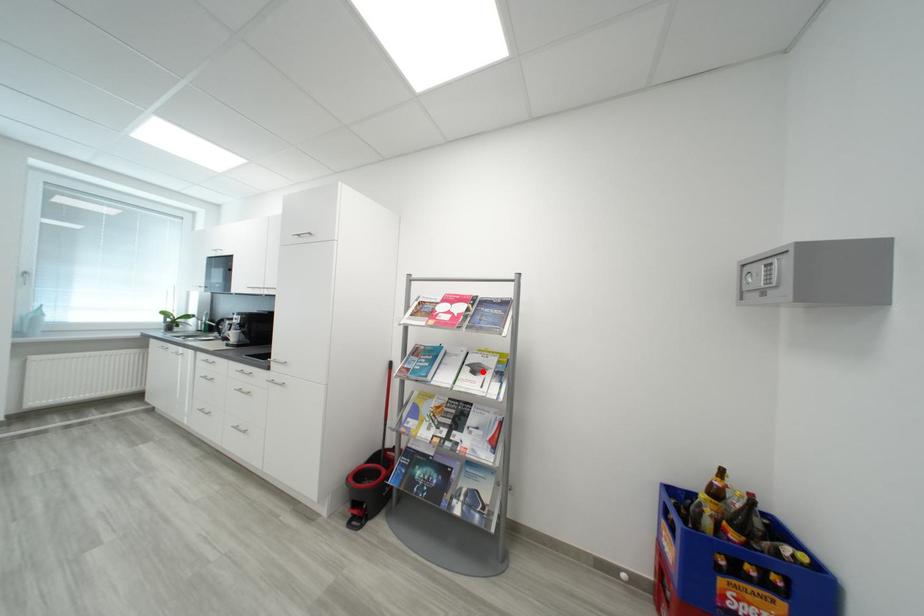
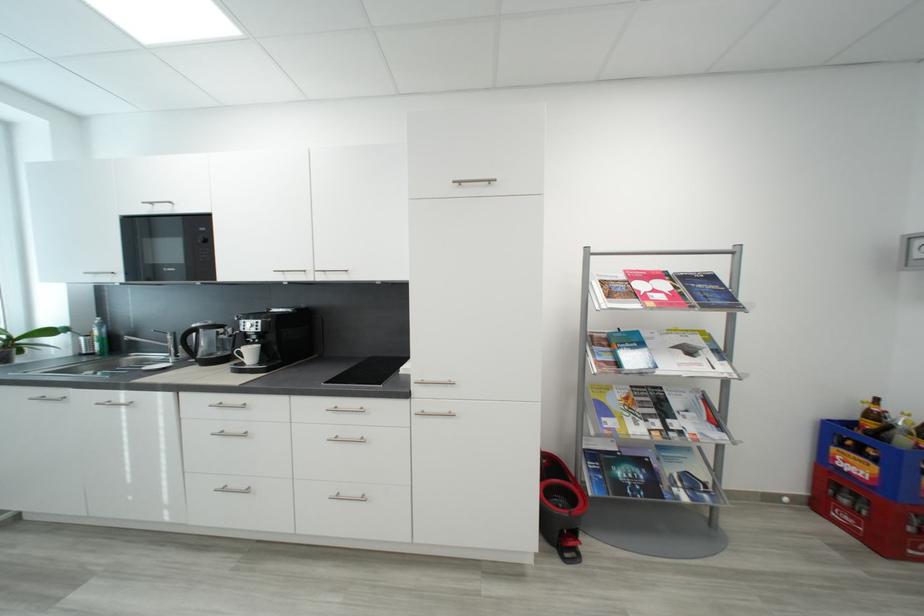
Where in the second image is the point corresponding to the highlighted location from the first image?

(697, 353)